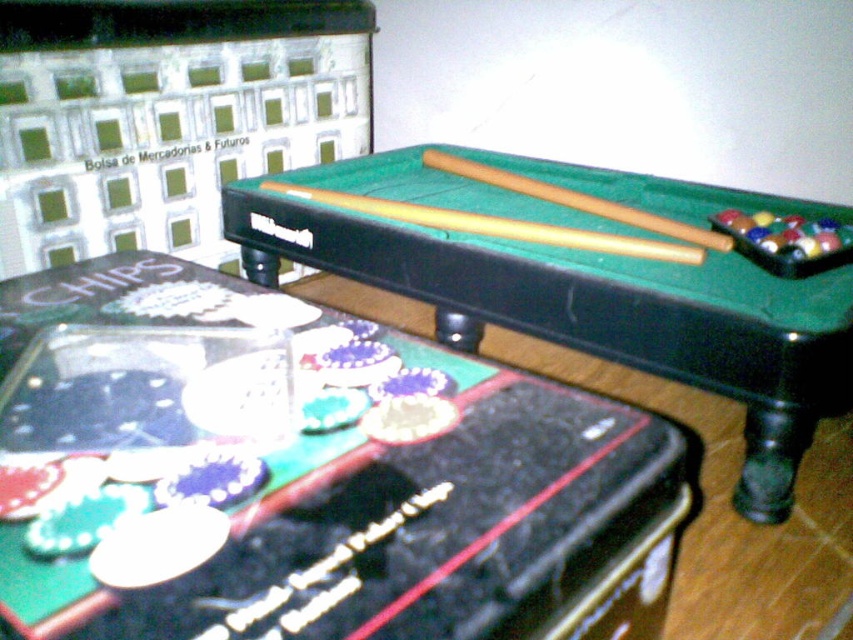
Question: Can you confirm if green felt pool table at upper center is positioned below wooden at center?

Choices:
 (A) yes
 (B) no

Answer: (A)

Question: Observing the image, what is the correct spatial positioning of green felt pool table at upper center in reference to wooden cue at center?

Choices:
 (A) right
 (B) left

Answer: (B)

Question: Which point appears closest to the camera in this image?

Choices:
 (A) (601, 289)
 (B) (397, 218)
 (C) (601, 468)
 (D) (444, 160)

Answer: (C)

Question: Does green felt pool table at center have a smaller size compared to wooden cue at center?

Choices:
 (A) yes
 (B) no

Answer: (B)

Question: Which point is closer to the camera?

Choices:
 (A) wooden cue at center
 (B) wooden at center
 (C) green felt pool table at upper center
 (D) green felt pool table at center

Answer: (C)

Question: Which point is closer to the camera taking this photo?

Choices:
 (A) (293, 364)
 (B) (737, 378)
 (C) (717, 246)
 (D) (610, 237)

Answer: (A)